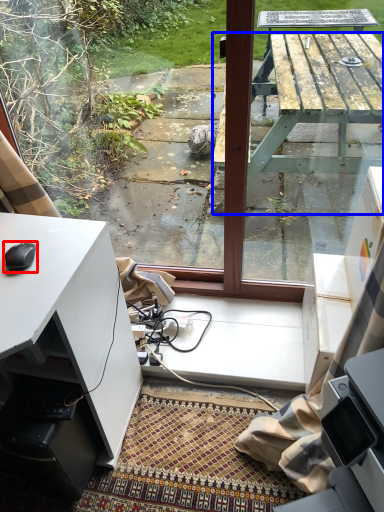
Question: Which of the following is the farthest to the observer, mouse (highlighted by a red box) or table (highlighted by a blue box)?

Choices:
 (A) mouse
 (B) table

Answer: (A)